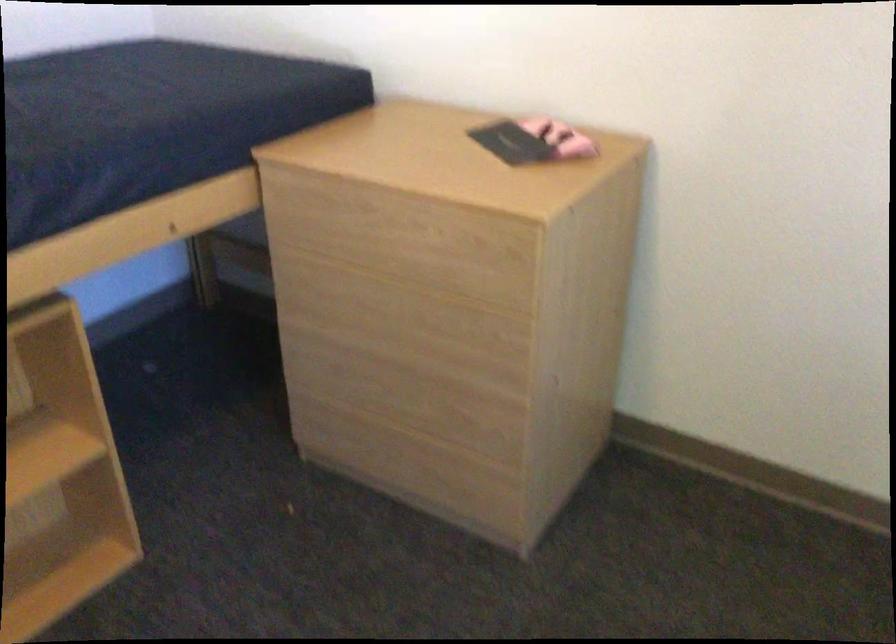
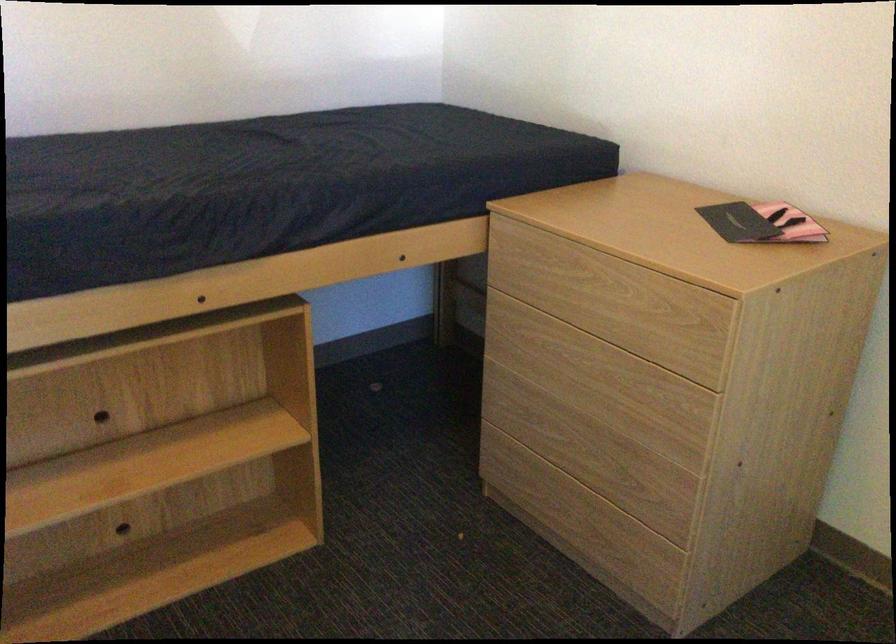
Locate, in the second image, the point that corresponds to (435,401) in the first image.

(607, 464)